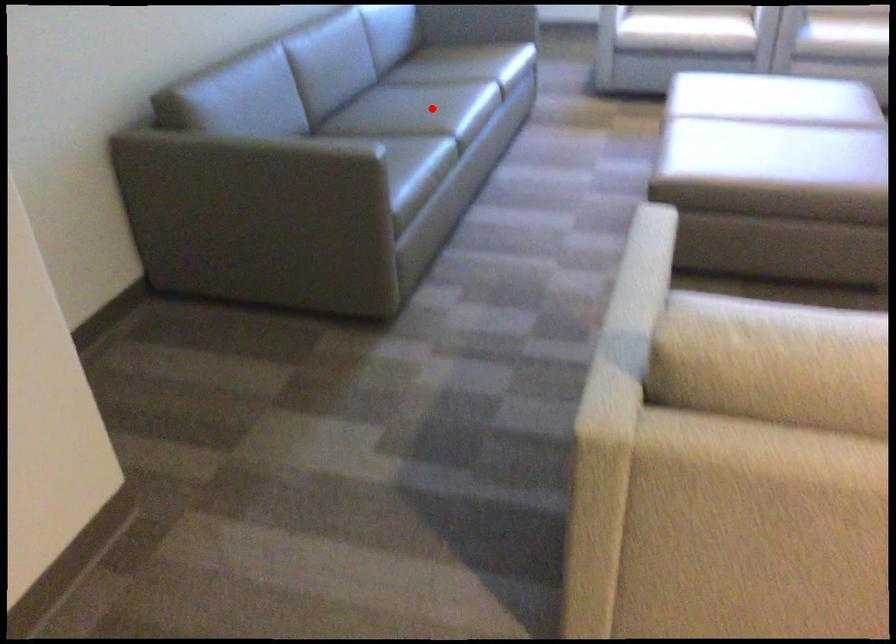
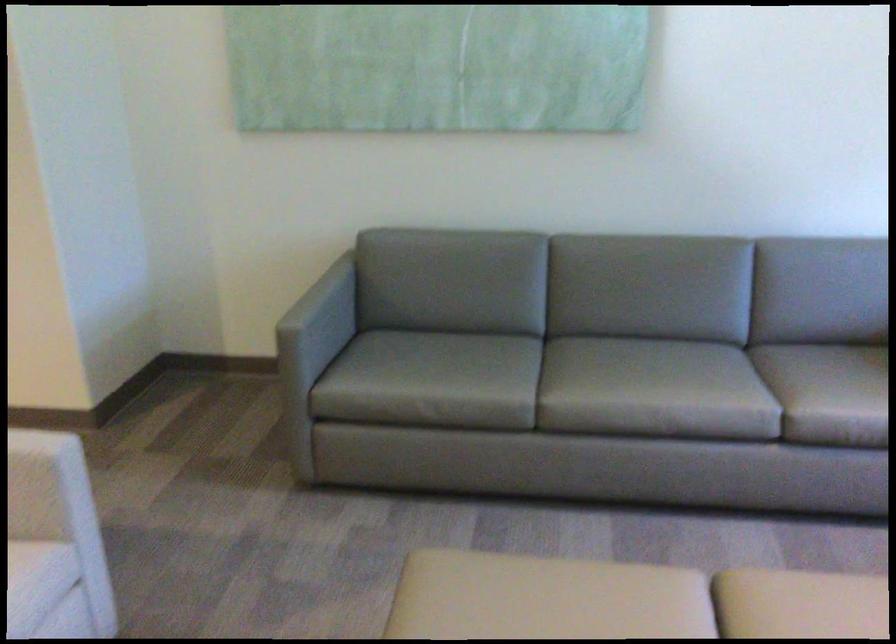
Question: A red point is marked in image1. In image2, is the corresponding 3D point closer to the camera or farther? Reply with the corresponding letter.

Choices:
 (A) The corresponding 3D point is closer.
 (B) The corresponding 3D point is farther.

Answer: (A)